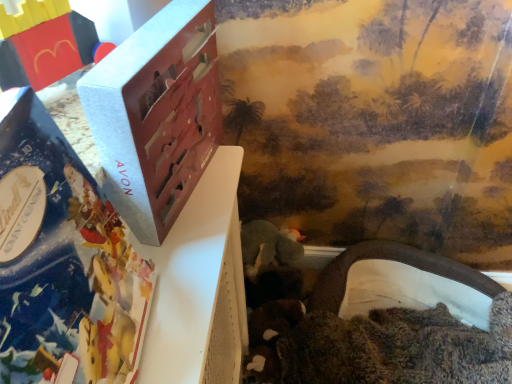
Question: Is brick-like plastic toy at upper left, positioned as the 2th toy in back-to-front order, not near white fabric tunnel at lower right, positioned as the 2th toy in top-to-bottom order?

Choices:
 (A) no
 (B) yes

Answer: (B)

Question: Is brick-like plastic toy at upper left, positioned as the 2th toy in back-to-front order, in front of white fabric tunnel at lower right, acting as the second toy starting from the front?

Choices:
 (A) yes
 (B) no

Answer: (A)

Question: From a real-world perspective, is brick-like plastic toy at upper left, positioned as the 2th toy in back-to-front order, under white fabric tunnel at lower right, which is the 1th toy from back to front?

Choices:
 (A) no
 (B) yes

Answer: (A)

Question: Considering the relative sizes of brick-like plastic toy at upper left, positioned as the 2th toy in back-to-front order, and white fabric tunnel at lower right, acting as the second toy starting from the front, in the image provided, is brick-like plastic toy at upper left, positioned as the 2th toy in back-to-front order, bigger than white fabric tunnel at lower right, acting as the second toy starting from the front,?

Choices:
 (A) yes
 (B) no

Answer: (B)

Question: Is brick-like plastic toy at upper left, which is the 2th toy in right-to-left order, shorter than white fabric tunnel at lower right, arranged as the 1th toy when ordered from the bottom?

Choices:
 (A) yes
 (B) no

Answer: (A)

Question: Is matte silver book at left to the left or to the right of brick-like plastic toy at upper left, arranged as the 2th toy when ordered from the bottom, in the image?

Choices:
 (A) right
 (B) left

Answer: (A)

Question: Looking at their shapes, would you say matte silver book at left is wider or thinner than brick-like plastic toy at upper left, marked as the 1th toy in a left-to-right arrangement?

Choices:
 (A) thin
 (B) wide

Answer: (B)

Question: From a real-world perspective, is matte silver book at left positioned above or below brick-like plastic toy at upper left, positioned as the 2th toy in back-to-front order?

Choices:
 (A) below
 (B) above

Answer: (A)

Question: Is matte silver book at left in front of or behind brick-like plastic toy at upper left, which is the 2th toy in right-to-left order, in the image?

Choices:
 (A) front
 (B) behind

Answer: (A)

Question: Visually, is matte silver book at left positioned to the left or to the right of white fabric tunnel at lower right, which is the first toy in right-to-left order?

Choices:
 (A) left
 (B) right

Answer: (A)

Question: Considering the positions of matte silver book at left and white fabric tunnel at lower right, which is the first toy in right-to-left order, in the image, is matte silver book at left bigger or smaller than white fabric tunnel at lower right, which is the first toy in right-to-left order,?

Choices:
 (A) big
 (B) small

Answer: (B)

Question: Considering the positions of matte silver book at left and white fabric tunnel at lower right, which is the 1th toy from back to front, in the image, is matte silver book at left wider or thinner than white fabric tunnel at lower right, which is the 1th toy from back to front,?

Choices:
 (A) thin
 (B) wide

Answer: (A)

Question: Is point (18, 243) closer or farther from the camera than point (480, 370)?

Choices:
 (A) farther
 (B) closer

Answer: (B)

Question: Based on their positions, is white fabric tunnel at lower right, which is the first toy in right-to-left order, located to the left or right of brick-like plastic toy at upper left, marked as the 1th toy in a left-to-right arrangement?

Choices:
 (A) left
 (B) right

Answer: (B)

Question: From a real-world perspective, is white fabric tunnel at lower right, which is the 1th toy from back to front, above or below brick-like plastic toy at upper left, marked as the 1th toy in a left-to-right arrangement?

Choices:
 (A) above
 (B) below

Answer: (B)